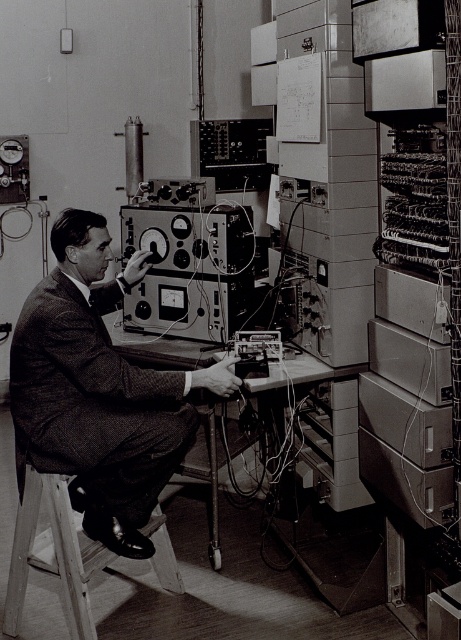
Question: Which point is closer to the camera taking this photo?

Choices:
 (A) (106, 548)
 (B) (135, 472)

Answer: (B)

Question: Does textured wool suit at center appear over wooden stool at lower left?

Choices:
 (A) no
 (B) yes

Answer: (B)

Question: Is textured wool suit at center positioned at the back of wooden stool at lower left?

Choices:
 (A) yes
 (B) no

Answer: (B)

Question: Does textured wool suit at center have a greater width compared to wooden stool at lower left?

Choices:
 (A) no
 (B) yes

Answer: (B)